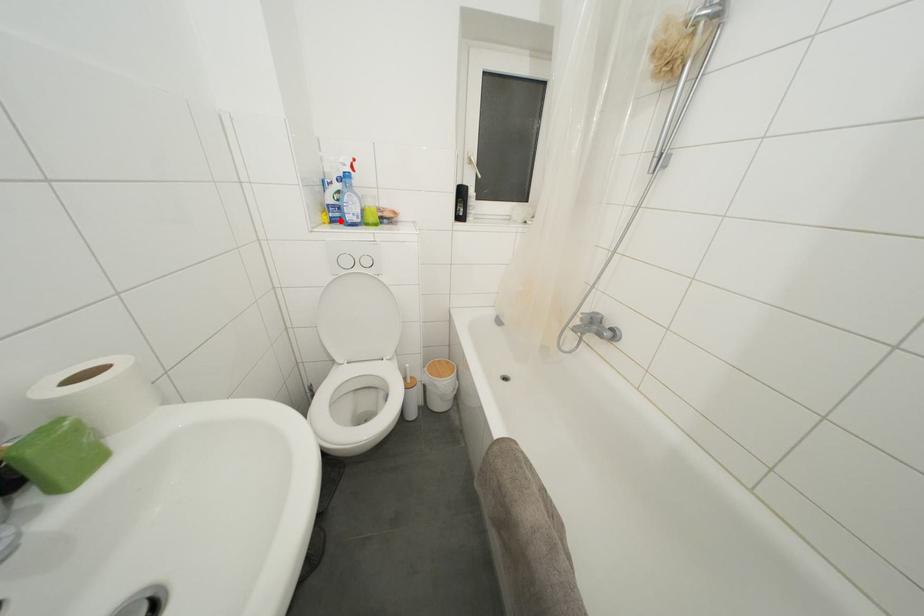
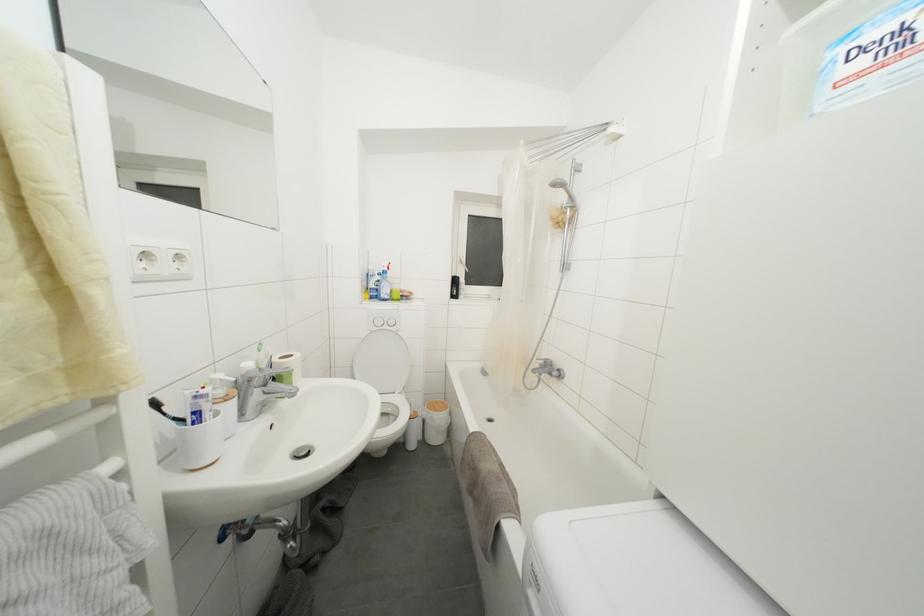
Find the pixel in the second image that matches the highlighted location in the first image.

(379, 300)